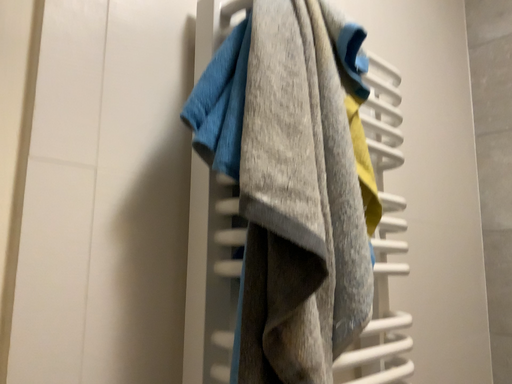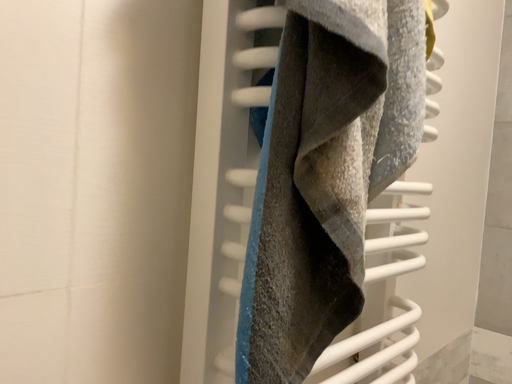
Question: Which way did the camera rotate in the video?

Choices:
 (A) rotated downward
 (B) rotated upward

Answer: (A)